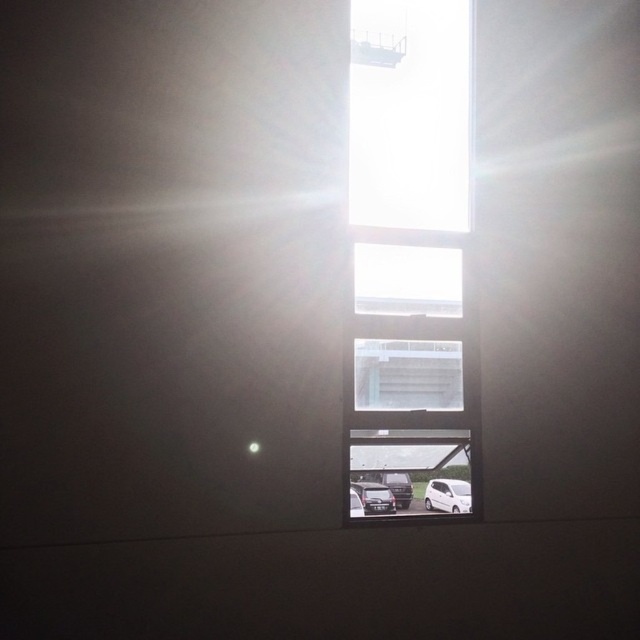
Question: Is the position of shiny silver car at bottom center more distant than that of shiny black car at center?

Choices:
 (A) no
 (B) yes

Answer: (A)

Question: Which object is positioned closest to the shiny silver car at bottom center?

Choices:
 (A) transparent glass window at center
 (B) shiny black car at center

Answer: (B)

Question: Among these objects, which one is nearest to the camera?

Choices:
 (A) transparent glass window at center
 (B) shiny silver car at bottom center
 (C) shiny black car at center
 (D) white matte van at lower center

Answer: (A)

Question: Does white matte van at lower center appear on the left side of shiny silver car at bottom center?

Choices:
 (A) no
 (B) yes

Answer: (A)

Question: Is transparent glass window at center above white matte van at lower center?

Choices:
 (A) yes
 (B) no

Answer: (A)

Question: Which object is positioned farthest from the shiny black car at center?

Choices:
 (A) transparent glass window at center
 (B) shiny silver car at bottom center
 (C) white matte van at lower center

Answer: (A)